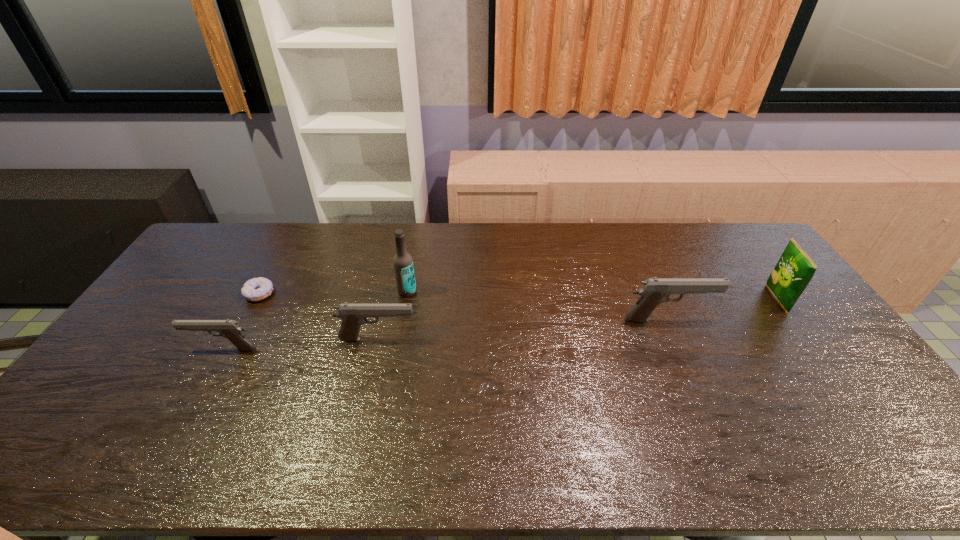
Identify the location of vacant region located at the barrel of the second nearest object. (474, 339).

This screenshot has height=540, width=960. I want to click on vacant space positioned at the barrel of the fifth object from left to right, so tap(786, 320).

At what (x,y) coordinates should I click in order to perform the action: click on free location located 0.090m on the side of the beer bottle with the label. Please return your answer as a coordinate pair (x, y). This screenshot has width=960, height=540. Looking at the image, I should click on (402, 319).

Locate an element on the screen. The height and width of the screenshot is (540, 960). vacant space located on the front-facing side of the crisp (potato chip) is located at coordinates (651, 299).

The width and height of the screenshot is (960, 540). I want to click on vacant region located 0.200m on the front-facing side of the crisp (potato chip), so tap(707, 299).

You are a GUI agent. You are given a task and a screenshot of the screen. Output one action in this format:
    pyautogui.click(x=<x>, y=<y>)
    Task: Click on the free spot located 0.350m on the front-facing side of the crisp (potato chip)
    
    Given the screenshot: What is the action you would take?
    coord(660,299)

Locate an element on the screen. The height and width of the screenshot is (540, 960). vacant position located 0.150m on the left of the doughnut is located at coordinates (200, 294).

At what (x,y) coordinates should I click in order to perform the action: click on object at the right edge. Please return your answer as a coordinate pair (x, y). The width and height of the screenshot is (960, 540). Looking at the image, I should click on (793, 272).

Identify the location of free space at the far edge of the desktop. pyautogui.click(x=639, y=253).

Identify the location of vacant space at the near edge of the desktop. (251, 424).